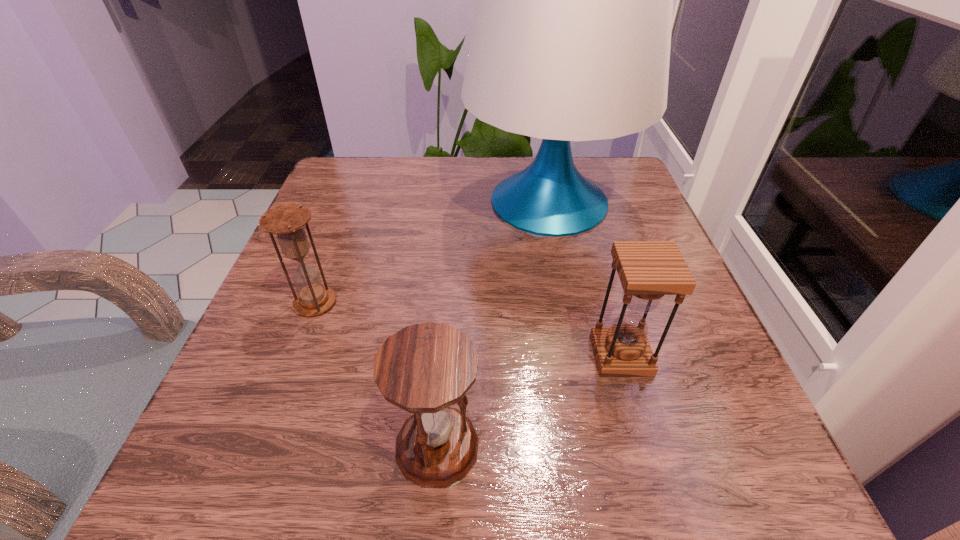
Find the location of `vacant area that lies between the farthest hourglass and the third farthest object`. vacant area that lies between the farthest hourglass and the third farthest object is located at coordinates (468, 329).

This screenshot has width=960, height=540. Find the location of `free point between the farthest object and the third farthest object`. free point between the farthest object and the third farthest object is located at coordinates (585, 278).

This screenshot has height=540, width=960. What are the coordinates of `object that is the third closest to the farthest object` in the screenshot? It's located at point(425,368).

Locate an element on the screen. The image size is (960, 540). object that is the closest to the nearest hourglass is located at coordinates (648, 270).

You are a GUI agent. You are given a task and a screenshot of the screen. Output one action in this format:
    pyautogui.click(x=<x>, y=<y>)
    Task: Click on the hourglass that is the closest one to the second nearest hourglass
    The image size is (960, 540).
    Given the screenshot: What is the action you would take?
    pyautogui.click(x=425, y=368)

Where is `hourglass that is the closest one to the nearest hourglass`? This screenshot has width=960, height=540. hourglass that is the closest one to the nearest hourglass is located at coordinates (648, 270).

Locate an element on the screen. free space that satisfies the following two spatial constraints: 1. on the front-facing side of the table lamp; 2. on the left side of the rightmost hourglass is located at coordinates (580, 355).

The image size is (960, 540). Identify the location of vacant space that satisfies the following two spatial constraints: 1. on the back side of the nearest object; 2. on the right side of the rightmost hourglass. (444, 355).

Where is `vacant space that satisfies the following two spatial constraints: 1. on the front-facing side of the tallest object; 2. on the left side of the second farthest hourglass`? The width and height of the screenshot is (960, 540). vacant space that satisfies the following two spatial constraints: 1. on the front-facing side of the tallest object; 2. on the left side of the second farthest hourglass is located at coordinates (580, 355).

At what (x,y) coordinates should I click in order to perform the action: click on vacant area that satisfies the following two spatial constraints: 1. on the front side of the leftmost object; 2. on the right side of the nearest object. Please return your answer as a coordinate pair (x, y). Image resolution: width=960 pixels, height=540 pixels. Looking at the image, I should click on (261, 446).